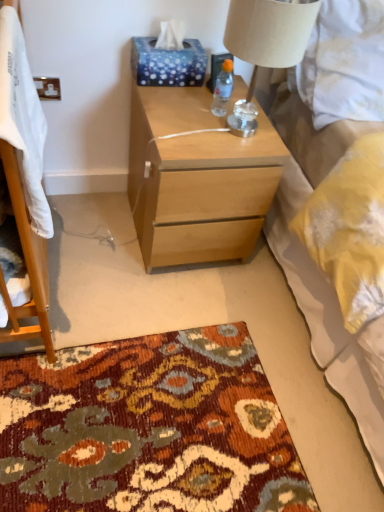
The image size is (384, 512). Find the location of `free space above light wood/finish nightstand at center (from a real-world perspective)`. free space above light wood/finish nightstand at center (from a real-world perspective) is located at coordinates (206, 113).